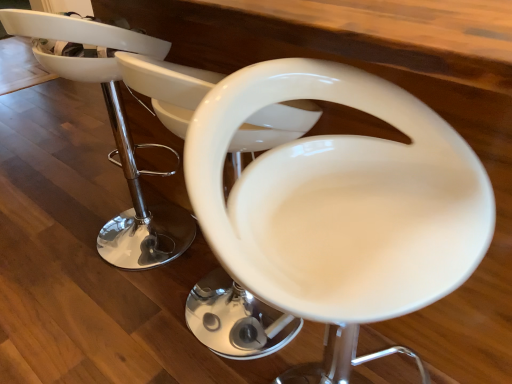
You are a GUI agent. You are given a task and a screenshot of the screen. Output one action in this format:
    pyautogui.click(x=<x>, y=<y>)
    Task: Click on the free point to the left of white glossy bar stool at center
    The image size is (512, 384).
    Given the screenshot: What is the action you would take?
    pyautogui.click(x=53, y=235)